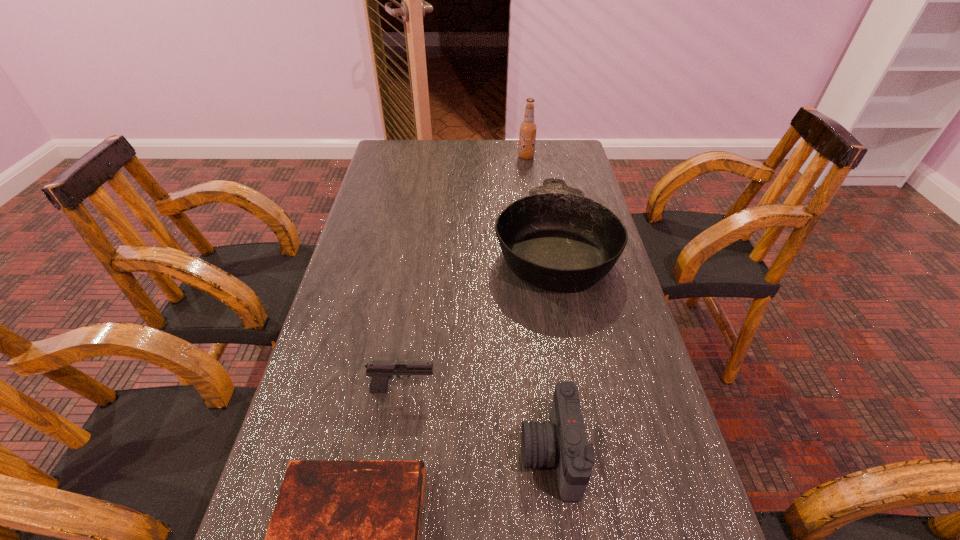
Identify the location of free location located 0.180m with the handle extending from the side of the frying pan. Image resolution: width=960 pixels, height=540 pixels. (540, 171).

Locate an element on the screen. vacant region located with the handle extending from the side of the frying pan is located at coordinates (542, 190).

Identify the location of free space located 0.260m at the lens of the camera. This screenshot has height=540, width=960. (383, 454).

Identify the location of vacant space located at the lens of the camera. (473, 454).

At what (x,y) coordinates should I click in order to perform the action: click on vacant space located at the lens of the camera. Please return your answer as a coordinate pair (x, y). This screenshot has width=960, height=540. Looking at the image, I should click on (468, 454).

Where is `free space located aim along the barrel of the pistol`? free space located aim along the barrel of the pistol is located at coordinates (460, 389).

Where is `object at the far edge`? The height and width of the screenshot is (540, 960). object at the far edge is located at coordinates (527, 137).

Where is `object at the left edge`? The width and height of the screenshot is (960, 540). object at the left edge is located at coordinates (380, 372).

Locate an element on the screen. object that is at the right edge is located at coordinates (556, 239).

Identify the location of vacant space at the far edge. (514, 147).